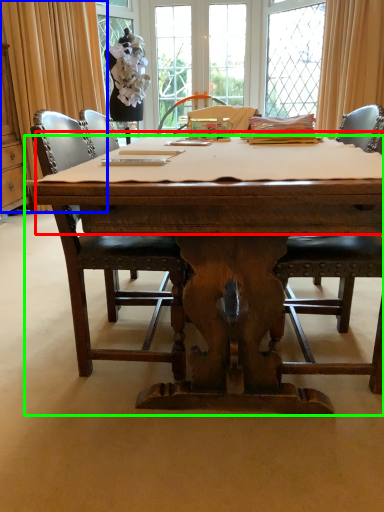
Question: Which object is the farthest from tablecloth (highlighted by a red box)? Choose among these: curtain (highlighted by a blue box) or desk (highlighted by a green box).

Choices:
 (A) curtain
 (B) desk

Answer: (A)